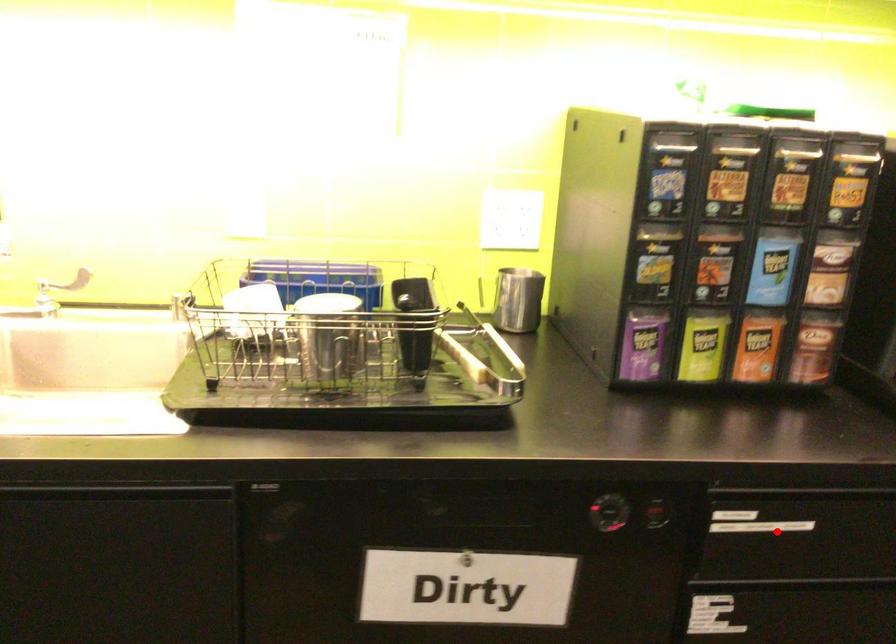
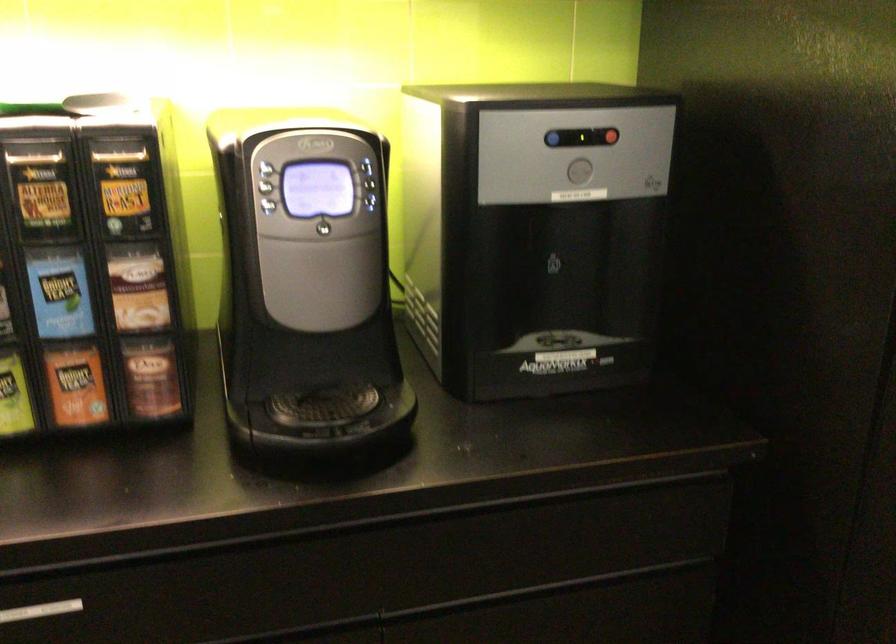
Question: A red point is marked in image1. In image2, is the corresponding 3D point closer to the camera or farther? Reply with the corresponding letter.

Choices:
 (A) The corresponding 3D point is closer.
 (B) The corresponding 3D point is farther.

Answer: (A)